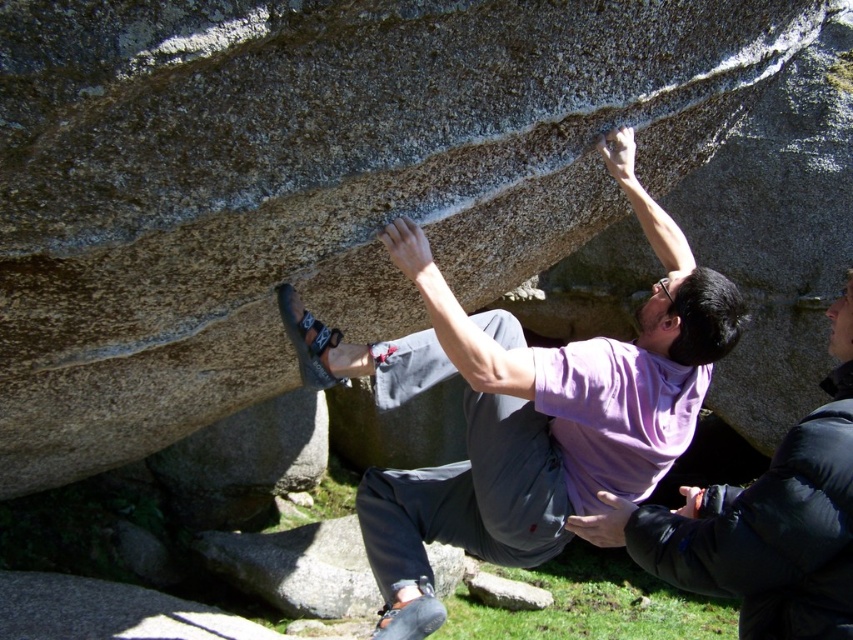
Based on the photo, where is the purple matte shirt at upper center located in the image?

The purple matte shirt at upper center is located at the 2D coordinates point (x=763, y=522).

You are a photographer positioned to capture the climber. You notice the purple cotton shirt at center and the gray rough rock at lower center in your frame. Which object should you adjust your focus to ensure the taller one is in sharp focus?

The purple cotton shirt at center is taller than the gray rough rock at lower center, so you should focus on the purple cotton shirt at center to ensure it is in sharp focus.

You are a rock climbing instructor observing the climber. You notice two purple shirts in the scene. Which shirt is wider? The purple cotton shirt at center or the purple matte shirt at upper center?

The purple cotton shirt at center is wider than the purple matte shirt at upper center.